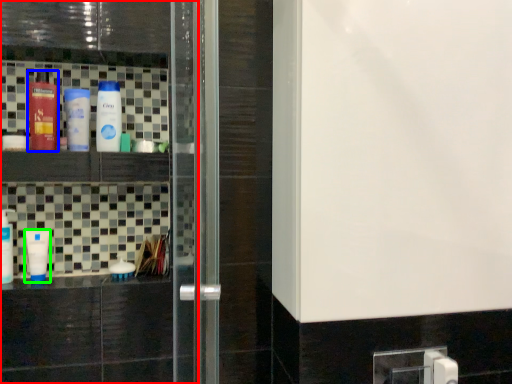
Question: Estimate the real-world distances between objects in this image. Which object is closer to screen door (highlighted by a red box), bottle (highlighted by a blue box) or bottle (highlighted by a green box)?

Choices:
 (A) bottle
 (B) bottle

Answer: (B)